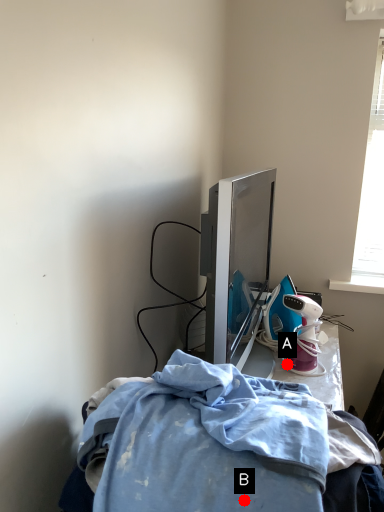
Question: Two points are circled on the image, labeled by A and B beside each circle. Which point is farther from the camera taking this photo?

Choices:
 (A) A is further
 (B) B is further

Answer: (A)